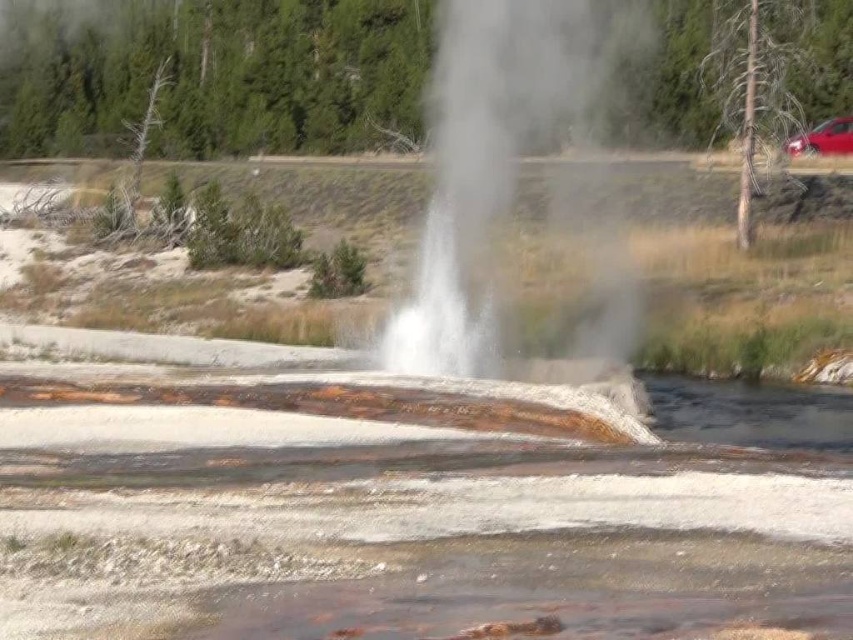
You are a park ranger standing at the edge of the geothermal area. You need to place a safety barrier around the geyser. The barrier must be placed at a specific coordinate to ensure visitor safety. According to the map, the white textured water at center is located at point 0.816, 0.461. What is the exact coordinate where you should place the barrier to surround the geyser?

The white textured water at center is located at point (x=392, y=522), so the safety barrier should be placed around this coordinate to surround the geyser.

You are a park ranger observing the geyser eruption. You notice the white textured water at center and the white vapor at center. Which of these two elements is larger in size?

The white vapor at center is larger in size compared to the white textured water at center.